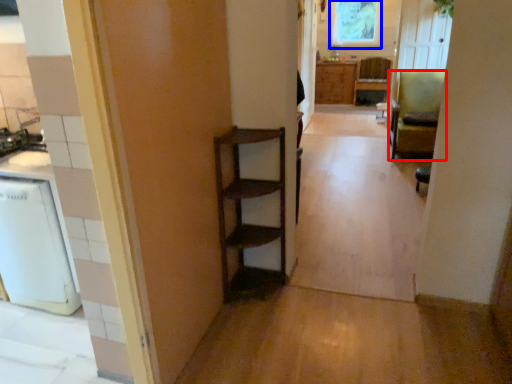
Question: Which object appears closest to the camera in this image, chair (highlighted by a red box) or window screen (highlighted by a blue box)?

Choices:
 (A) chair
 (B) window screen

Answer: (A)